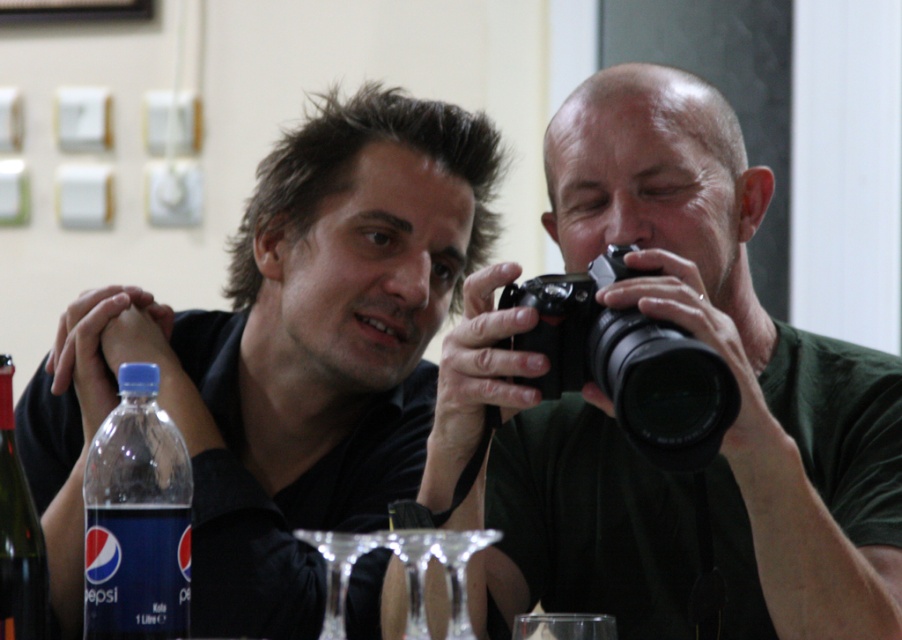
Question: Estimate the real-world distances between objects in this image. Which object is farther from the blue plastic bottle at lower left?

Choices:
 (A) matte black shirt at center
 (B) black matte camera at center

Answer: (A)

Question: Considering the real-world distances, which object is farthest from the black matte camera at center?

Choices:
 (A) blue plastic bottle at lower left
 (B) black plastic camera at center

Answer: (A)

Question: Does matte black shirt at center have a smaller size compared to black plastic camera at center?

Choices:
 (A) yes
 (B) no

Answer: (B)

Question: Among these points, which one is farthest from the camera?

Choices:
 (A) (862, 608)
 (B) (116, 561)

Answer: (A)

Question: Considering the relative positions of black matte camera at center and blue plastic bottle at lower left in the image provided, where is black matte camera at center located with respect to blue plastic bottle at lower left?

Choices:
 (A) below
 (B) above

Answer: (B)

Question: Can you confirm if black matte camera at center is positioned above matte black shirt at center?

Choices:
 (A) yes
 (B) no

Answer: (A)